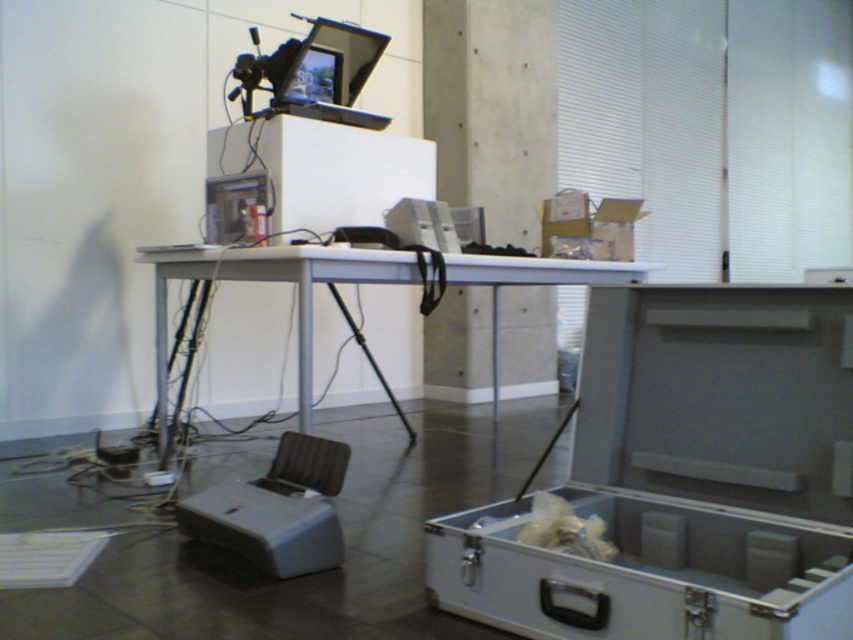
Question: Is metallic gray cooler at lower right positioned before white plastic table at center?

Choices:
 (A) no
 (B) yes

Answer: (B)

Question: Does metallic gray cooler at lower right appear under white plastic table at center?

Choices:
 (A) no
 (B) yes

Answer: (B)

Question: From the image, what is the correct spatial relationship of metallic gray cooler at lower right in relation to white plastic table at center?

Choices:
 (A) left
 (B) right

Answer: (B)

Question: Which of the following is the closest to the observer?

Choices:
 (A) (393, 269)
 (B) (743, 352)

Answer: (B)

Question: Which point appears closest to the camera in this image?

Choices:
 (A) tap(483, 552)
 (B) tap(143, 246)

Answer: (A)